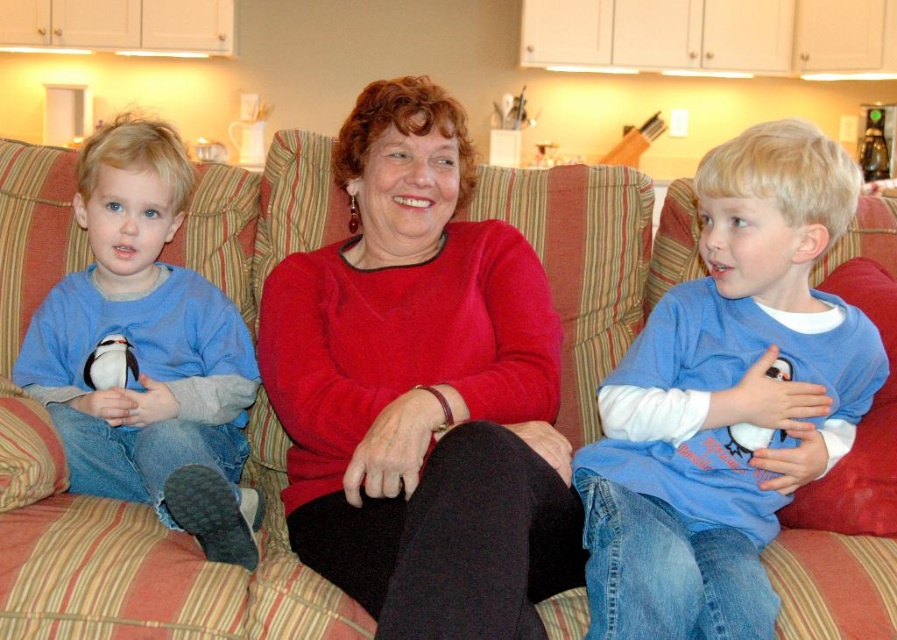
Question: Does matte red sweater at center appear under blue cotton shirt at right?

Choices:
 (A) no
 (B) yes

Answer: (A)

Question: Considering the relative positions of blue cotton shirt at right and matte blue shirt at left in the image provided, where is blue cotton shirt at right located with respect to matte blue shirt at left?

Choices:
 (A) below
 (B) above

Answer: (A)

Question: Which of the following is the farthest from the observer?

Choices:
 (A) (103, 182)
 (B) (747, 572)
 (C) (469, 461)

Answer: (A)

Question: Does matte red sweater at center have a greater width compared to matte blue shirt at left?

Choices:
 (A) no
 (B) yes

Answer: (B)

Question: Which point appears closest to the camera in this image?

Choices:
 (A) (804, 176)
 (B) (46, 349)
 (C) (578, 538)

Answer: (C)

Question: Which point is farther to the camera?

Choices:
 (A) matte blue shirt at left
 (B) matte red sweater at center
 (C) blue cotton shirt at right

Answer: (A)